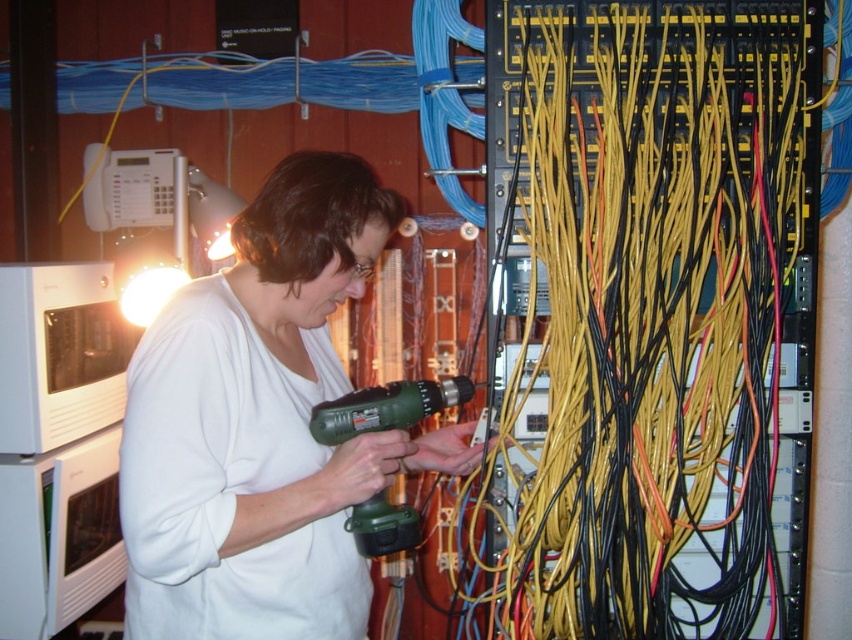
You are a technician in the server room. You need to reach the white matte shirt at center. Is the white matte shirt at center closer to the white appliance on the left or the point at [262,426]?

The point at [262,426] indicates the location of the white matte shirt at center, so they are the same position. Therefore, the white matte shirt at center is exactly at the point at [262,426].

You are standing in the server room and need to locate two specific points marked on the ceiling. The first point is at coordinate point(386, 433) and the second is at point(389, 516). From your vantage point, which point is closer to you?

Point(386, 433) is in front of point(389, 516), so it is closer to you.